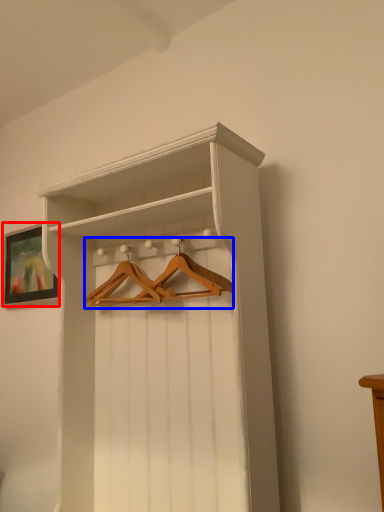
Question: Among these objects, which one is farthest to the camera, picture frame (highlighted by a red box) or hanger (highlighted by a blue box)?

Choices:
 (A) picture frame
 (B) hanger

Answer: (A)